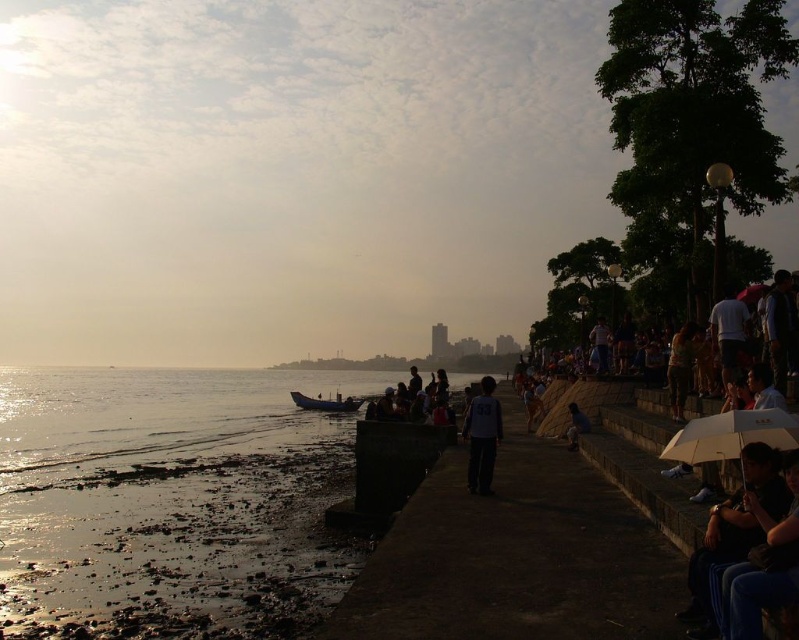
Question: Does matte white umbrella at right appear on the right side of brown leather jacket at center?

Choices:
 (A) yes
 (B) no

Answer: (B)

Question: Considering the real-world distances, which object is closest to the wooden boat at lower center?

Choices:
 (A) white matte umbrella at lower right
 (B) blue denim jeans at lower right

Answer: (A)

Question: Is matte white umbrella at right positioned before brown leather jacket at center?

Choices:
 (A) no
 (B) yes

Answer: (B)

Question: Which object is farther from the camera taking this photo?

Choices:
 (A) wooden boat at lower center
 (B) blue denim jeans at lower right
 (C) white matte umbrella at lower right
 (D) brown leather jacket at center

Answer: (A)

Question: Is blue denim jeans at lower right bigger than white matte umbrella at lower right?

Choices:
 (A) no
 (B) yes

Answer: (A)

Question: Which object is closer to the camera taking this photo?

Choices:
 (A) wooden boat at lower center
 (B) brown leather jacket at center

Answer: (B)